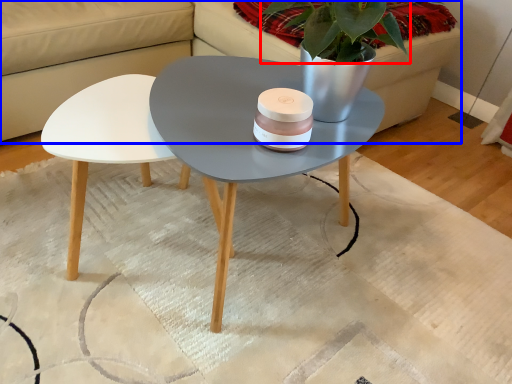
Question: Which object appears farthest to the camera in this image, plant (highlighted by a red box) or couch (highlighted by a blue box)?

Choices:
 (A) plant
 (B) couch

Answer: (A)